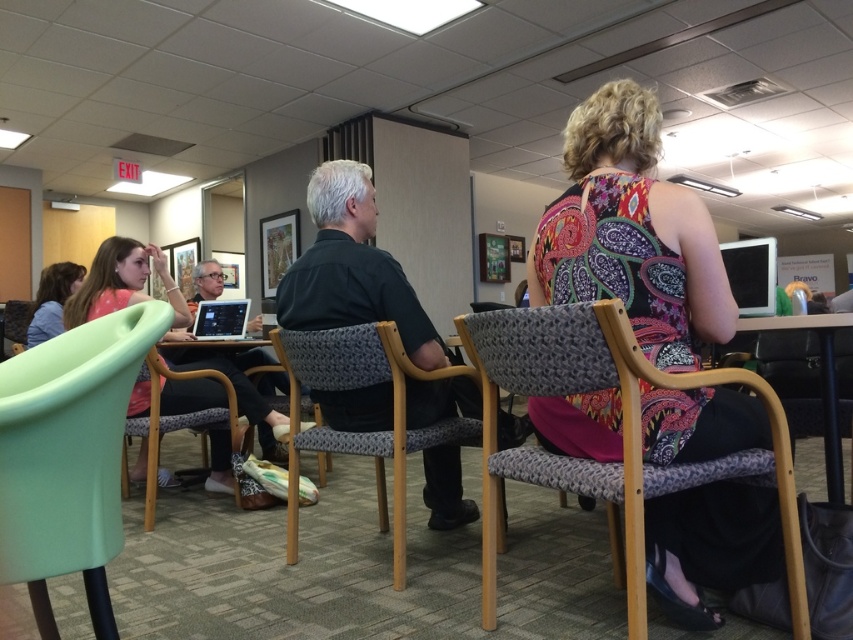
Can you confirm if mint green plastic chair at lower left is wider than black glossy tablet at upper right?

Yes.

In the scene shown: How far apart are mint green plastic chair at lower left and black glossy tablet at upper right?

The distance of mint green plastic chair at lower left from black glossy tablet at upper right is 6.36 feet.

Which is in front, point (88, 548) or point (762, 275)?

Positioned in front is point (88, 548).

You are a GUI agent. You are given a task and a screenshot of the screen. Output one action in this format:
    pyautogui.click(x=<x>, y=<y>)
    Task: Click on the mint green plastic chair at lower left
    The width and height of the screenshot is (853, 640).
    Given the screenshot: What is the action you would take?
    pyautogui.click(x=68, y=458)

Is the position of gray woven fabric chair at center more distant than that of matte black laptop at center?

No, it is in front of matte black laptop at center.

Does gray woven fabric chair at center have a lesser height compared to matte black laptop at center?

Incorrect, gray woven fabric chair at center's height does not fall short of matte black laptop at center's.

Which is in front, point (618, 371) or point (199, 321)?

Point (618, 371) is more forward.

This screenshot has width=853, height=640. I want to click on gray woven fabric chair at center, so click(624, 429).

Between matte pink dress at left and matte black laptop at center, which one appears on the left side from the viewer's perspective?

matte black laptop at center

Which is behind, point (216, 448) or point (195, 332)?

The point (195, 332) is more distant.

Locate an element on the screen. matte pink dress at left is located at coordinates (123, 284).